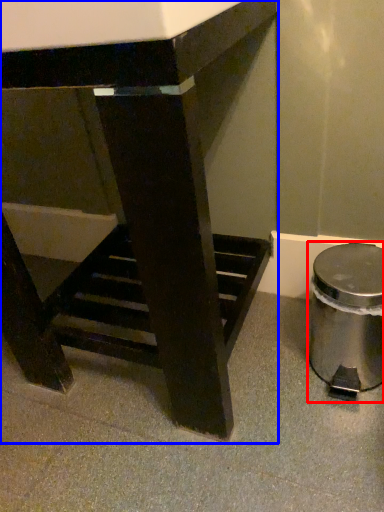
Question: Which of the following is the farthest to the observer, waste container (highlighted by a red box) or table (highlighted by a blue box)?

Choices:
 (A) waste container
 (B) table

Answer: (A)